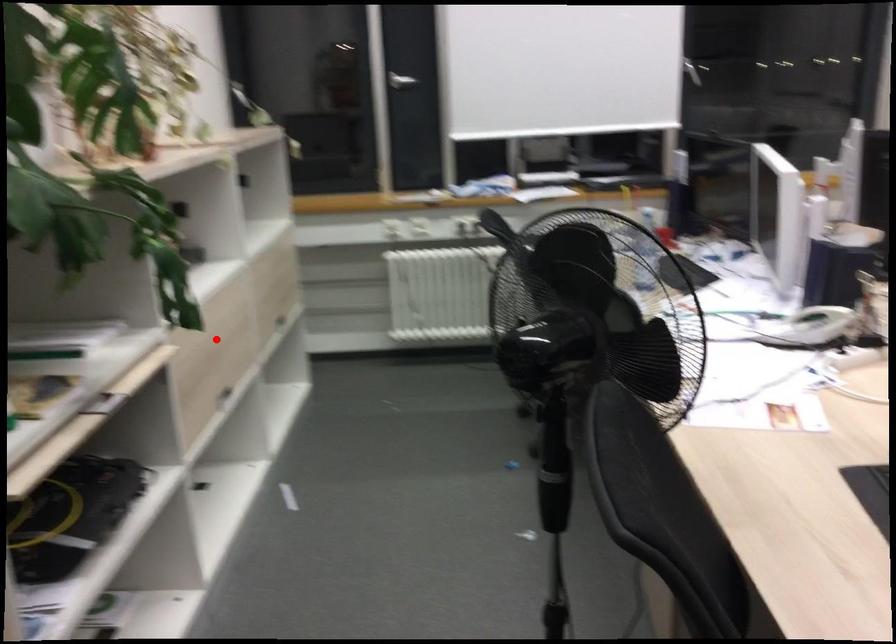
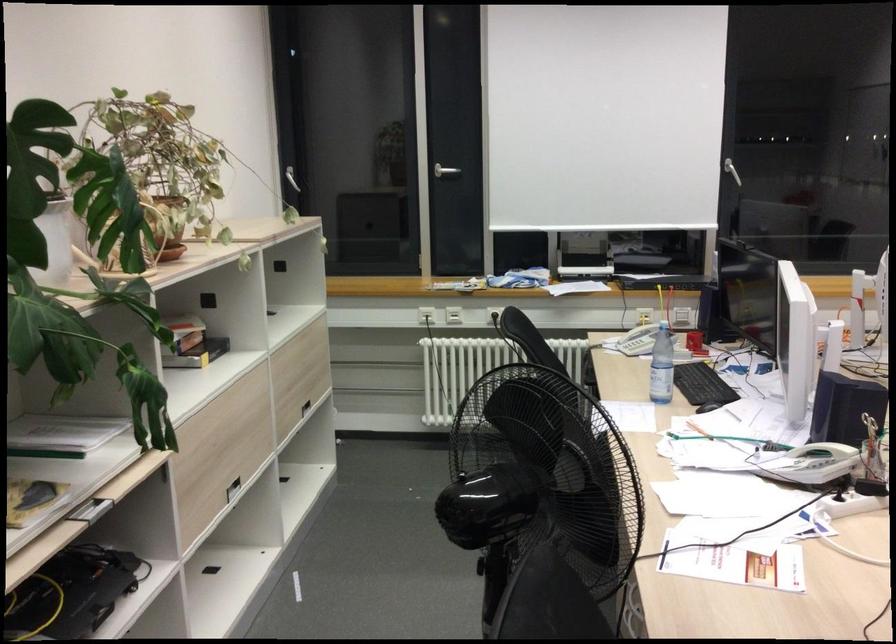
In the second image, find the point that corresponds to the highlighted location in the first image.

(225, 435)